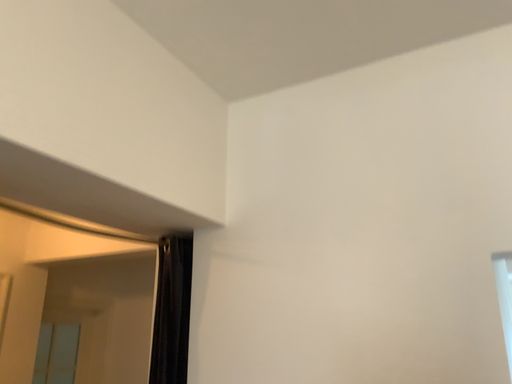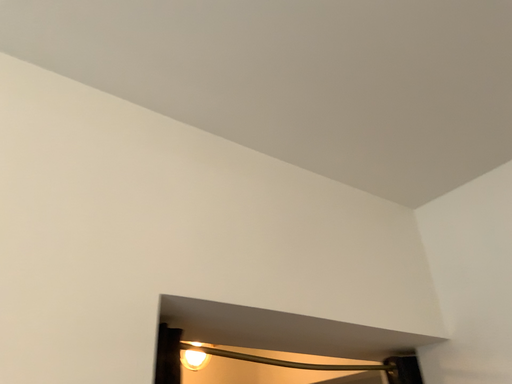
Question: Which way did the camera rotate in the video?

Choices:
 (A) rotated downward
 (B) rotated upward

Answer: (B)